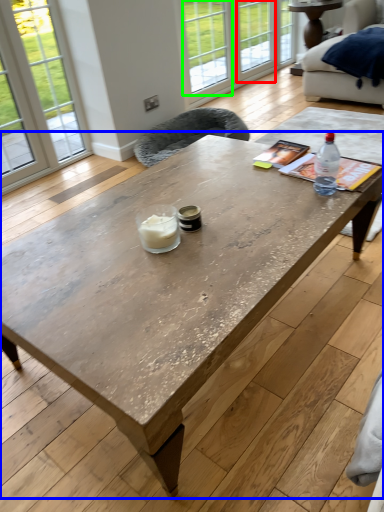
Question: Estimate the real-world distances between objects in this image. Which object is closer to window (highlighted by a red box), coffee table (highlighted by a blue box) or window (highlighted by a green box)?

Choices:
 (A) coffee table
 (B) window

Answer: (B)